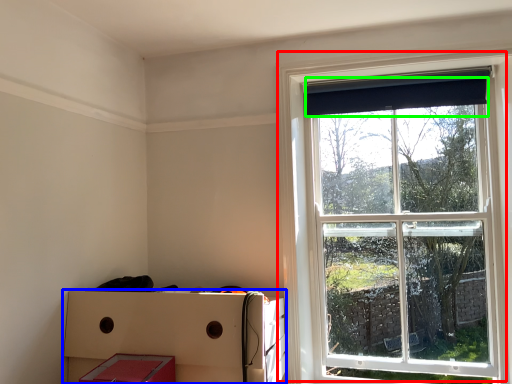
Question: Estimate the real-world distances between objects in this image. Which object is farther from window (highlighted by a red box), crate (highlighted by a blue box) or curtain (highlighted by a green box)?

Choices:
 (A) crate
 (B) curtain

Answer: (A)